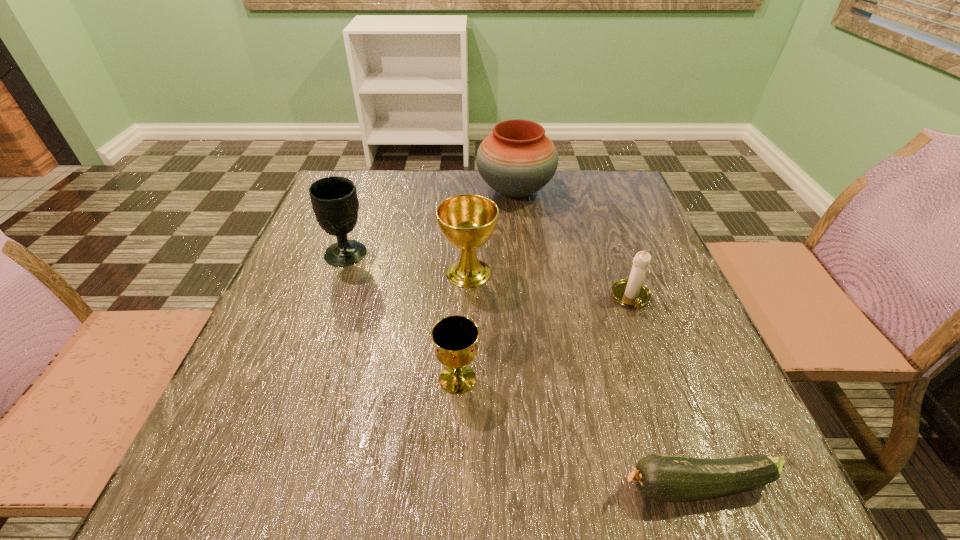
The image size is (960, 540). Identify the location of vacant space located 0.190m on the back of the second nearest object. (462, 289).

Identify the location of vacant space positioned 0.140m at the blossom end of the shortest object. (520, 487).

You are a GUI agent. You are given a task and a screenshot of the screen. Output one action in this format:
    pyautogui.click(x=<x>, y=<y>)
    Task: Click on the free location located at the blossom end of the shortest object
    Image resolution: width=960 pixels, height=540 pixels.
    Given the screenshot: What is the action you would take?
    pyautogui.click(x=382, y=487)

This screenshot has height=540, width=960. I want to click on vacant space located 0.180m at the blossom end of the shortest object, so coord(492,487).

Where is `object present at the far edge`? object present at the far edge is located at coordinates (516, 160).

Where is `object situated at the near edge`? The width and height of the screenshot is (960, 540). object situated at the near edge is located at coordinates (668, 478).

Image resolution: width=960 pixels, height=540 pixels. In order to click on object present at the left edge in this screenshot , I will do `click(334, 199)`.

Where is `candle holder that is at the right edge`? The width and height of the screenshot is (960, 540). candle holder that is at the right edge is located at coordinates (631, 292).

Locate an element on the screen. Image resolution: width=960 pixels, height=540 pixels. zucchini located in the right edge section of the desktop is located at coordinates (668, 478).

Identify the location of object that is at the near right corner. (668, 478).